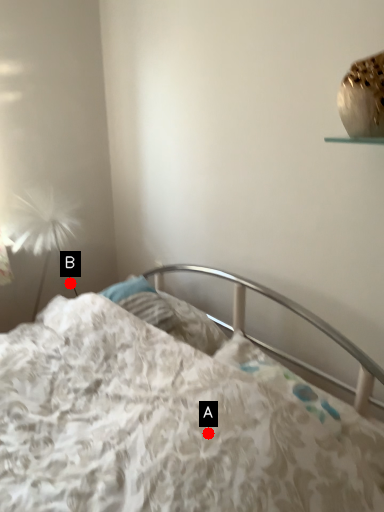
Question: Two points are circled on the image, labeled by A and B beside each circle. Which point is farther from the camera taking this photo?

Choices:
 (A) A is further
 (B) B is further

Answer: (B)